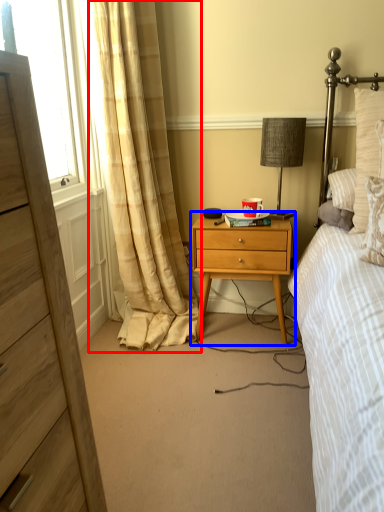
Question: Which of the following is the closest to the observer, curtain (highlighted by a red box) or nightstand (highlighted by a blue box)?

Choices:
 (A) curtain
 (B) nightstand

Answer: (A)